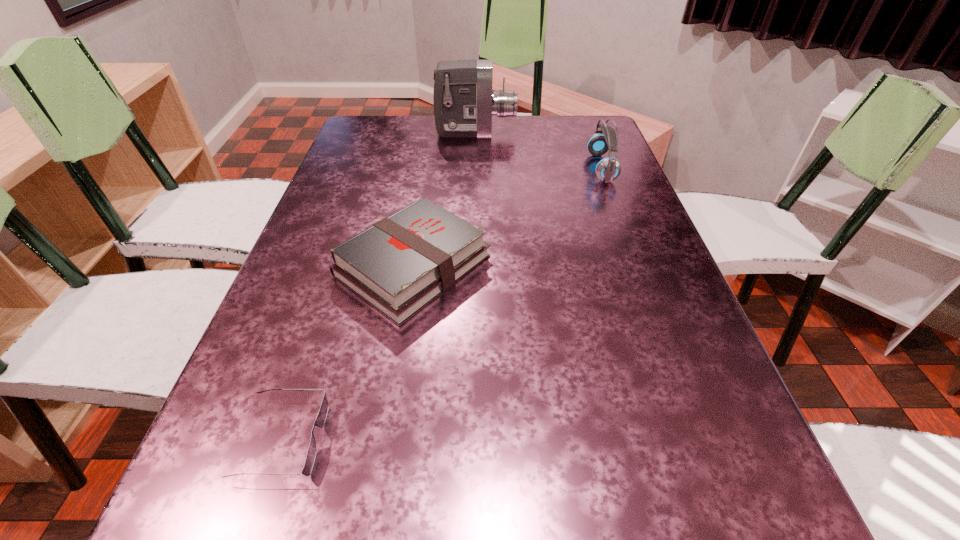
Where is `camcorder`? This screenshot has width=960, height=540. camcorder is located at coordinates (464, 103).

This screenshot has height=540, width=960. In order to click on the tallest object in this screenshot , I will do `click(464, 103)`.

Where is `the rightmost object`? The height and width of the screenshot is (540, 960). the rightmost object is located at coordinates (608, 169).

Identify the location of the second tallest object. (608, 169).

You are a GUI agent. You are given a task and a screenshot of the screen. Output one action in this format:
    pyautogui.click(x=<x>, y=<y>)
    Task: Click on the second nearest object
    
    Given the screenshot: What is the action you would take?
    pyautogui.click(x=400, y=264)

This screenshot has height=540, width=960. Find the location of `the second shortest object`. the second shortest object is located at coordinates (400, 264).

Where is `sunglasses`? Image resolution: width=960 pixels, height=540 pixels. sunglasses is located at coordinates (322, 415).

Find the location of a particular element. The height and width of the screenshot is (540, 960). the nearest object is located at coordinates (322, 415).

This screenshot has width=960, height=540. Find the location of `free region located 0.070m at the front of the tallest object, highlighting the lens`. free region located 0.070m at the front of the tallest object, highlighting the lens is located at coordinates pos(537,132).

The image size is (960, 540). What are the coordinates of `vacant space located on the ear cups of the rightmost object` in the screenshot? It's located at (534, 168).